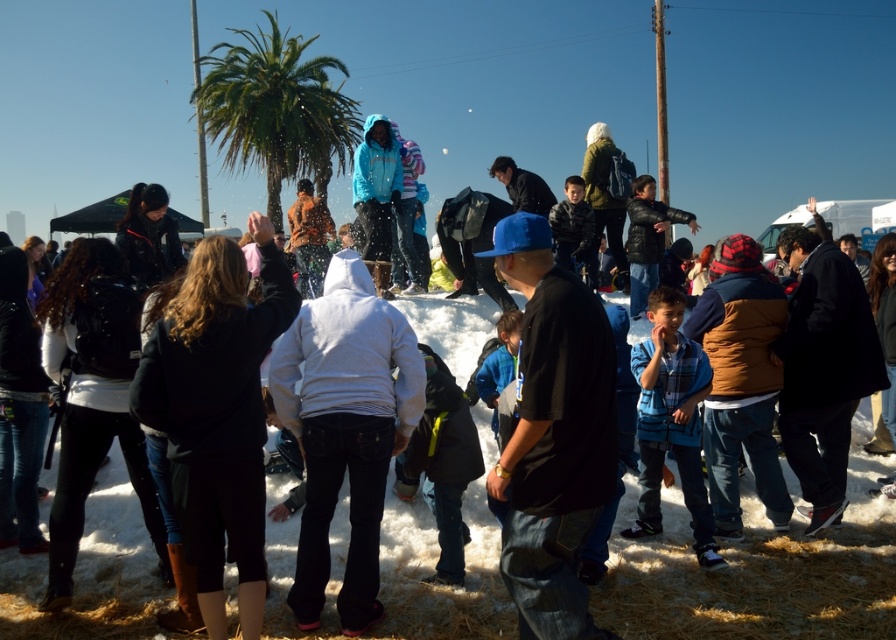
Between black matte shirt at center and green leafy palm tree at upper center, which one appears on the left side from the viewer's perspective?

From the viewer's perspective, green leafy palm tree at upper center appears more on the left side.

Is point (520, 554) more distant than point (256, 45)?

No, it is in front of (256, 45).

Between point (543, 515) and point (265, 12), which one is positioned behind?

Positioned behind is point (265, 12).

Find the location of a particular element. black matte shirt at center is located at coordinates (553, 435).